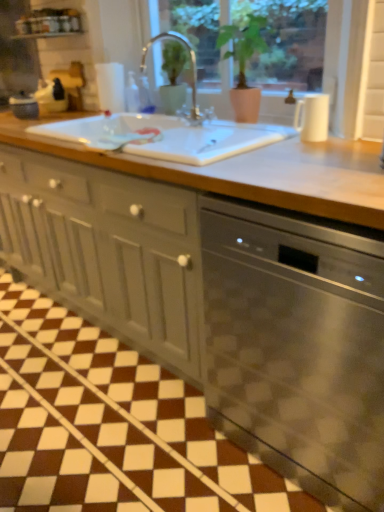
Question: Does satin nickel faucet at center have a smaller size compared to white glossy window sill at upper center?

Choices:
 (A) no
 (B) yes

Answer: (A)

Question: Considering the relative sizes of satin nickel faucet at center and white glossy window sill at upper center in the image provided, is satin nickel faucet at center taller than white glossy window sill at upper center?

Choices:
 (A) yes
 (B) no

Answer: (A)

Question: Is satin nickel faucet at center touching white glossy window sill at upper center?

Choices:
 (A) no
 (B) yes

Answer: (A)

Question: Considering the relative sizes of satin nickel faucet at center and white glossy window sill at upper center in the image provided, is satin nickel faucet at center thinner than white glossy window sill at upper center?

Choices:
 (A) no
 (B) yes

Answer: (B)

Question: From a real-world perspective, is satin nickel faucet at center beneath white glossy window sill at upper center?

Choices:
 (A) yes
 (B) no

Answer: (A)

Question: Considering the positions of matte black kettle at left, which is the 1th appliance from back to front, and stainless steel dishwasher at center in the image, is matte black kettle at left, which is the 1th appliance from back to front, taller or shorter than stainless steel dishwasher at center?

Choices:
 (A) tall
 (B) short

Answer: (B)

Question: Looking at their shapes, would you say matte black kettle at left, marked as the 1th appliance in a top-to-bottom arrangement, is wider or thinner than stainless steel dishwasher at center?

Choices:
 (A) thin
 (B) wide

Answer: (A)

Question: From a real-world perspective, is matte black kettle at left, the 2th appliance from the bottom, positioned above or below stainless steel dishwasher at center?

Choices:
 (A) below
 (B) above

Answer: (B)

Question: Is matte black kettle at left, marked as the 1th appliance in a top-to-bottom arrangement, spatially inside stainless steel dishwasher at center, or outside of it?

Choices:
 (A) outside
 (B) inside

Answer: (A)

Question: Does point (200, 141) appear closer or farther from the camera than point (91, 303)?

Choices:
 (A) closer
 (B) farther

Answer: (A)

Question: From a real-world perspective, is white ceramic sink at center positioned above or below matte gray cabinet at center?

Choices:
 (A) above
 (B) below

Answer: (A)

Question: Relative to matte gray cabinet at center, is white ceramic sink at center in front or behind?

Choices:
 (A) front
 (B) behind

Answer: (B)

Question: Looking at their shapes, would you say white ceramic sink at center is wider or thinner than matte gray cabinet at center?

Choices:
 (A) thin
 (B) wide

Answer: (A)

Question: Is white glossy window sill at upper center to the left or to the right of matte gray cabinet at center in the image?

Choices:
 (A) left
 (B) right

Answer: (A)

Question: Considering the positions of white glossy window sill at upper center and matte gray cabinet at center in the image, is white glossy window sill at upper center bigger or smaller than matte gray cabinet at center?

Choices:
 (A) big
 (B) small

Answer: (B)